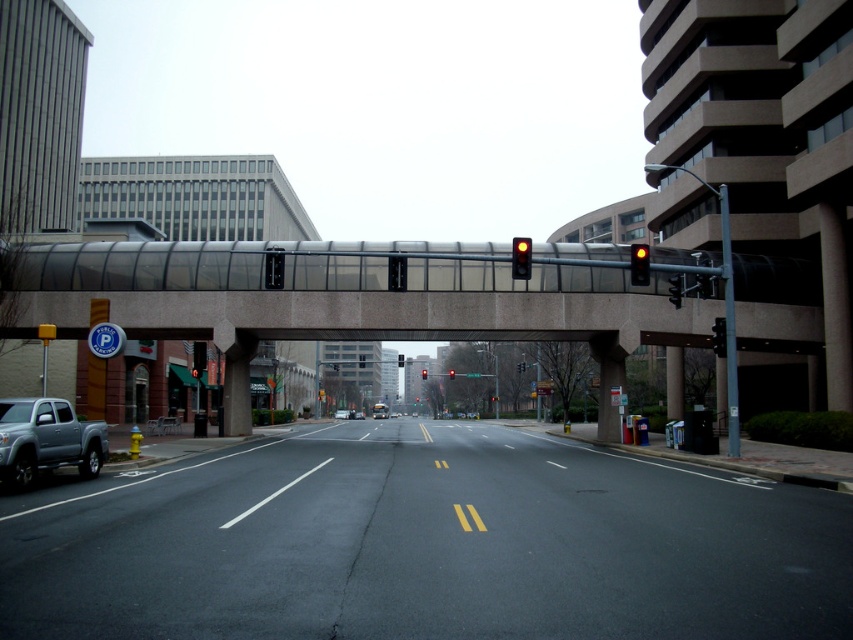
Between metallic traffic light at right and silver metallic sedan at center, which one appears on the right side from the viewer's perspective?

Positioned to the right is metallic traffic light at right.

Is metallic traffic light at right below silver metallic sedan at center?

No.

Does point (712, 324) come behind point (347, 412)?

No.

This screenshot has height=640, width=853. Identify the location of metallic traffic light at right. click(x=718, y=337).

Is yellow glass traffic light at upper center closer to camera compared to red glass traffic light at upper center?

Yes.

What do you see at coordinates (639, 264) in the screenshot?
I see `yellow glass traffic light at upper center` at bounding box center [639, 264].

Where is `yellow glass traffic light at upper center`? yellow glass traffic light at upper center is located at coordinates (639, 264).

Which is more to the right, matte gray truck at lower left or yellow glass traffic light at center?

yellow glass traffic light at center is more to the right.

Is matte gray truck at lower left smaller than yellow glass traffic light at center?

Indeed, matte gray truck at lower left has a smaller size compared to yellow glass traffic light at center.

Where is `matte gray truck at lower left`? The image size is (853, 640). matte gray truck at lower left is located at coordinates (45, 440).